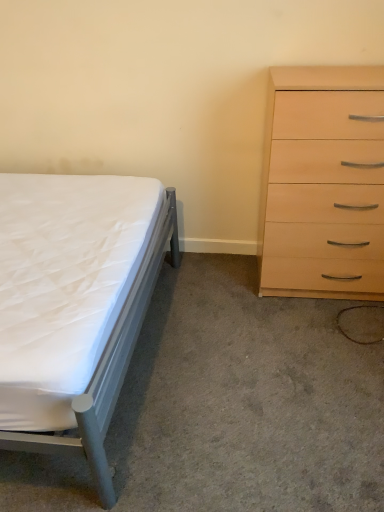
Question: Is white matte bed at left thinner than white fabric bed at left?

Choices:
 (A) yes
 (B) no

Answer: (A)

Question: Does white matte bed at left turn towards white fabric bed at left?

Choices:
 (A) no
 (B) yes

Answer: (B)

Question: From the image's perspective, does white matte bed at left appear higher than white fabric bed at left?

Choices:
 (A) yes
 (B) no

Answer: (A)

Question: Can you confirm if white matte bed at left is positioned to the right of white fabric bed at left?

Choices:
 (A) no
 (B) yes

Answer: (A)

Question: Is white matte bed at left smaller than white fabric bed at left?

Choices:
 (A) yes
 (B) no

Answer: (B)

Question: Is light wood/finish chest of drawers at right to the left or to the right of white matte bed at left in the image?

Choices:
 (A) right
 (B) left

Answer: (A)

Question: Considering the positions of point (339, 261) and point (8, 369), is point (339, 261) closer or farther from the camera than point (8, 369)?

Choices:
 (A) farther
 (B) closer

Answer: (A)

Question: Which is correct: light wood/finish chest of drawers at right is inside white matte bed at left, or outside of it?

Choices:
 (A) outside
 (B) inside

Answer: (A)

Question: Considering the positions of light wood/finish chest of drawers at right and white matte bed at left in the image, is light wood/finish chest of drawers at right bigger or smaller than white matte bed at left?

Choices:
 (A) small
 (B) big

Answer: (A)

Question: Looking at the image, does white matte bed at left seem bigger or smaller compared to white fabric bed at left?

Choices:
 (A) small
 (B) big

Answer: (B)

Question: In the image, is white matte bed at left positioned in front of or behind white fabric bed at left?

Choices:
 (A) behind
 (B) front

Answer: (B)

Question: From a real-world perspective, is white matte bed at left above or below white fabric bed at left?

Choices:
 (A) above
 (B) below

Answer: (A)

Question: Choose the correct answer: Is white matte bed at left inside white fabric bed at left or outside it?

Choices:
 (A) inside
 (B) outside

Answer: (B)

Question: Looking at the image, does white fabric bed at left seem bigger or smaller compared to light wood/finish chest of drawers at right?

Choices:
 (A) big
 (B) small

Answer: (B)

Question: Is point (243, 366) closer or farther from the camera than point (269, 220)?

Choices:
 (A) closer
 (B) farther

Answer: (A)